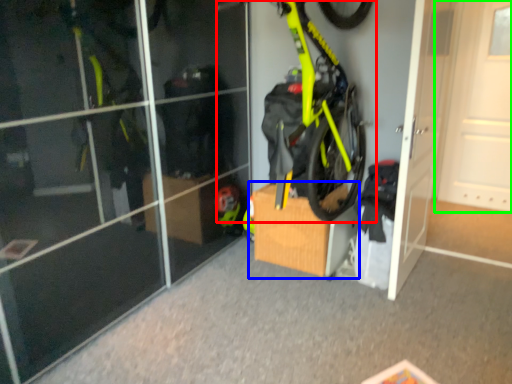
Question: Which object is the closest to the bicycle (highlighted by a red box)? Choose among these: cardboard box (highlighted by a blue box) or door (highlighted by a green box).

Choices:
 (A) cardboard box
 (B) door

Answer: (A)